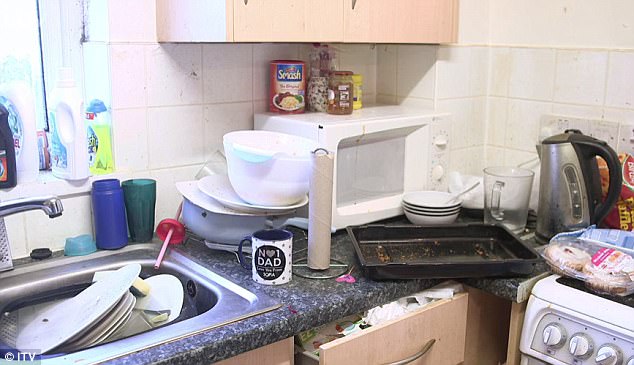
You are a GUI agent. You are given a task and a screenshot of the screen. Output one action in this format:
    pyautogui.click(x=<x>, y=<y>)
    Task: Click on the paper towel holder
    The height and width of the screenshot is (365, 634).
    Given the screenshot: What is the action you would take?
    point(333,264)